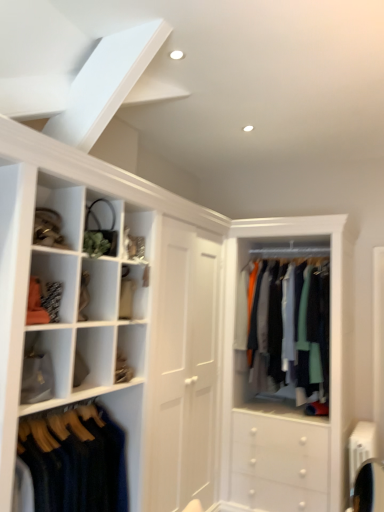
Question: From a real-world perspective, is silky cotton shirts at center, the 1th clothing from the back, beneath matte gold purse at upper left, the second cabinet positioned from the top?

Choices:
 (A) no
 (B) yes

Answer: (B)

Question: Can you confirm if silky cotton shirts at center, the second clothing when ordered from left to right, is thinner than matte gold purse at upper left, the second cabinet positioned from the top?

Choices:
 (A) yes
 (B) no

Answer: (B)

Question: Is silky cotton shirts at center, which is counted as the first clothing, starting from the right, touching matte gold purse at upper left, marked as the 2th cabinet in a bottom-to-top arrangement?

Choices:
 (A) yes
 (B) no

Answer: (B)

Question: Is silky cotton shirts at center, which is counted as the first clothing, starting from the right, completely or partially outside of matte gold purse at upper left, the second cabinet positioned from the top?

Choices:
 (A) yes
 (B) no

Answer: (A)

Question: Can you confirm if silky cotton shirts at center, placed as the 2th clothing when sorted from front to back, is positioned to the left of matte gold purse at upper left, the second cabinet positioned from the top?

Choices:
 (A) no
 (B) yes

Answer: (A)

Question: From a real-world perspective, is dark blue wool sweater at lower left, which is the 2th clothing in back-to-front order, physically located above or below matte gold purse at upper left, the second cabinet positioned from the top?

Choices:
 (A) below
 (B) above

Answer: (A)

Question: Considering the positions of dark blue wool sweater at lower left, placed as the first clothing when sorted from left to right, and matte gold purse at upper left, the second cabinet positioned from the top, in the image, is dark blue wool sweater at lower left, placed as the first clothing when sorted from left to right, wider or thinner than matte gold purse at upper left, the second cabinet positioned from the top,?

Choices:
 (A) thin
 (B) wide

Answer: (B)

Question: Which is correct: dark blue wool sweater at lower left, acting as the 1th clothing starting from the front, is inside matte gold purse at upper left, the second cabinet positioned from the top, or outside of it?

Choices:
 (A) inside
 (B) outside

Answer: (B)

Question: From the image's perspective, is dark blue wool sweater at lower left, which appears as the second clothing when viewed from the right, above or below matte gold purse at upper left, the second cabinet positioned from the top?

Choices:
 (A) above
 (B) below

Answer: (B)

Question: From a real-world perspective, relative to silky cotton shirts at center, the second clothing when ordered from left to right, is dark blue wool sweater at lower left, acting as the 1th clothing starting from the front, vertically above or below?

Choices:
 (A) above
 (B) below

Answer: (B)

Question: Is dark blue wool sweater at lower left, acting as the 1th clothing starting from the front, in front of or behind silky cotton shirts at center, the second clothing when ordered from left to right, in the image?

Choices:
 (A) behind
 (B) front

Answer: (B)

Question: Looking at the image, does dark blue wool sweater at lower left, placed as the first clothing when sorted from left to right, seem bigger or smaller compared to silky cotton shirts at center, which is counted as the first clothing, starting from the right?

Choices:
 (A) big
 (B) small

Answer: (B)

Question: Choose the correct answer: Is dark blue wool sweater at lower left, which is the 2th clothing in back-to-front order, inside silky cotton shirts at center, which is counted as the first clothing, starting from the right, or outside it?

Choices:
 (A) inside
 (B) outside

Answer: (B)

Question: From the image's perspective, relative to matte black purse at upper left, which is the third cabinet in bottom-to-top order, is matte gold purse at upper left, marked as the 2th cabinet in a bottom-to-top arrangement, above or below?

Choices:
 (A) above
 (B) below

Answer: (B)

Question: Based on their positions, is matte gold purse at upper left, marked as the 2th cabinet in a bottom-to-top arrangement, located to the left or right of matte black purse at upper left, which is the third cabinet in bottom-to-top order?

Choices:
 (A) right
 (B) left

Answer: (B)